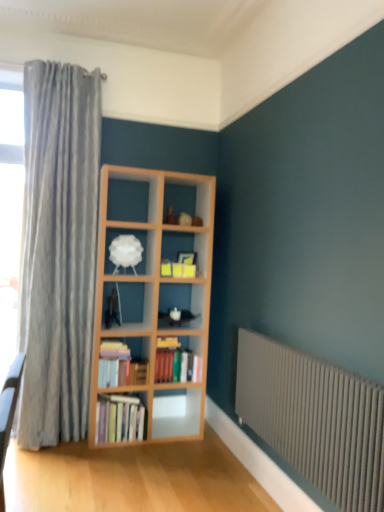
This screenshot has height=512, width=384. What are the coordinates of `vacant space underneath hardcover books at center, acting as the 2th book starting from the bottom (from a real-world perspective)` in the screenshot? It's located at (170, 432).